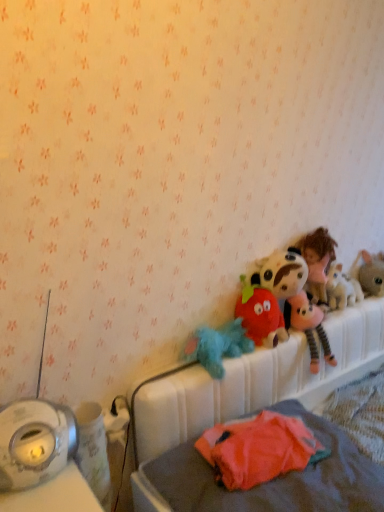
Question: From the image's perspective, is fluffy gray rabbit at right, which is the 1th toy in right-to-left order, above fluffy blue plush at center, the fifth toy viewed from the right?

Choices:
 (A) yes
 (B) no

Answer: (A)

Question: Considering the relative sizes of fluffy gray rabbit at right, which is the 1th toy in right-to-left order, and fluffy blue plush at center, placed as the first toy when sorted from left to right, in the image provided, is fluffy gray rabbit at right, which is the 1th toy in right-to-left order, wider than fluffy blue plush at center, placed as the first toy when sorted from left to right,?

Choices:
 (A) yes
 (B) no

Answer: (B)

Question: Considering the relative sizes of fluffy gray rabbit at right, the fifth toy positioned from the left, and fluffy blue plush at center, placed as the first toy when sorted from left to right, in the image provided, is fluffy gray rabbit at right, the fifth toy positioned from the left, shorter than fluffy blue plush at center, placed as the first toy when sorted from left to right,?

Choices:
 (A) no
 (B) yes

Answer: (A)

Question: Is the surface of fluffy gray rabbit at right, which is the 1th toy in right-to-left order, in direct contact with fluffy blue plush at center, the fifth toy viewed from the right?

Choices:
 (A) yes
 (B) no

Answer: (B)

Question: Considering the relative sizes of fluffy gray rabbit at right, the fifth toy positioned from the left, and fluffy blue plush at center, the fifth toy viewed from the right, in the image provided, is fluffy gray rabbit at right, the fifth toy positioned from the left, thinner than fluffy blue plush at center, the fifth toy viewed from the right,?

Choices:
 (A) yes
 (B) no

Answer: (A)

Question: Is fluffy gray rabbit at right, which is the 1th toy in right-to-left order, positioned with its back to fluffy blue plush at center, placed as the first toy when sorted from left to right?

Choices:
 (A) yes
 (B) no

Answer: (B)

Question: Is fluffy blue plush at center, placed as the first toy when sorted from left to right, outside of fluffy plush toy at upper right, arranged as the fourth toy when viewed from the left?

Choices:
 (A) yes
 (B) no

Answer: (A)

Question: From the image's perspective, is fluffy blue plush at center, the fifth toy viewed from the right, located above fluffy plush toy at upper right, which is the second toy from right to left?

Choices:
 (A) no
 (B) yes

Answer: (A)

Question: Does fluffy blue plush at center, placed as the first toy when sorted from left to right, have a larger size compared to fluffy plush toy at upper right, arranged as the fourth toy when viewed from the left?

Choices:
 (A) yes
 (B) no

Answer: (A)

Question: Does fluffy blue plush at center, placed as the first toy when sorted from left to right, lie behind fluffy plush toy at upper right, arranged as the fourth toy when viewed from the left?

Choices:
 (A) yes
 (B) no

Answer: (B)

Question: Does fluffy blue plush at center, placed as the first toy when sorted from left to right, lie in front of fluffy plush toy at upper right, which is the second toy from right to left?

Choices:
 (A) yes
 (B) no

Answer: (A)

Question: Can you confirm if fluffy blue plush at center, placed as the first toy when sorted from left to right, is shorter than fluffy plush toy at upper right, arranged as the fourth toy when viewed from the left?

Choices:
 (A) yes
 (B) no

Answer: (A)

Question: Is fluffy plush strawberry at center, which is the third toy in left-to-right order, positioned with its back to fluffy plush toy at upper right, which is the second toy from right to left?

Choices:
 (A) no
 (B) yes

Answer: (A)